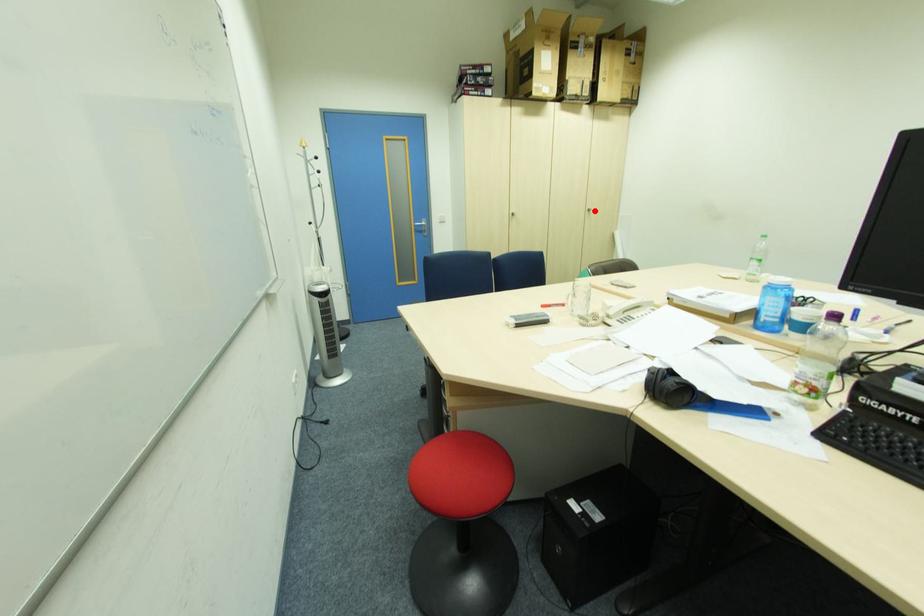
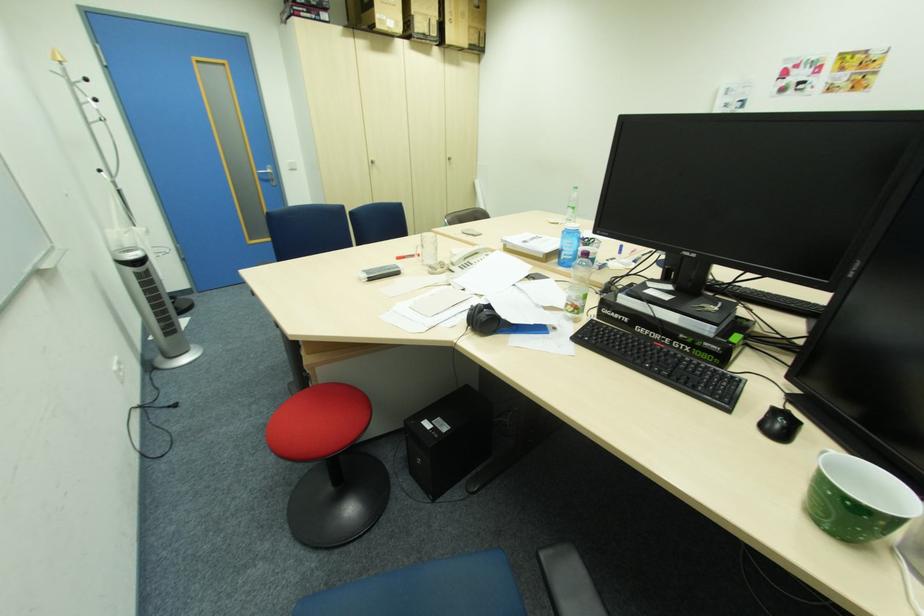
The point at the highlighted location is marked in the first image. Where is the corresponding point in the second image?

(456, 159)